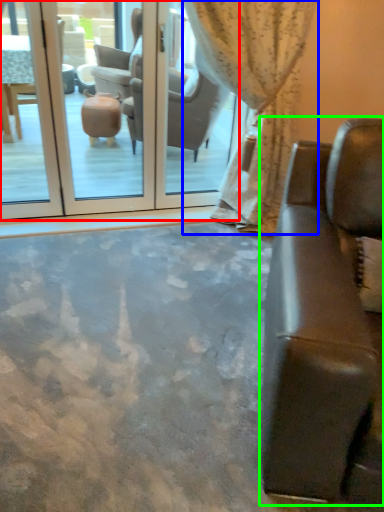
Question: Which object is positioned farthest from screen door (highlighted by a red box)? Select from curtain (highlighted by a blue box) and studio couch (highlighted by a green box).

Choices:
 (A) curtain
 (B) studio couch

Answer: (B)